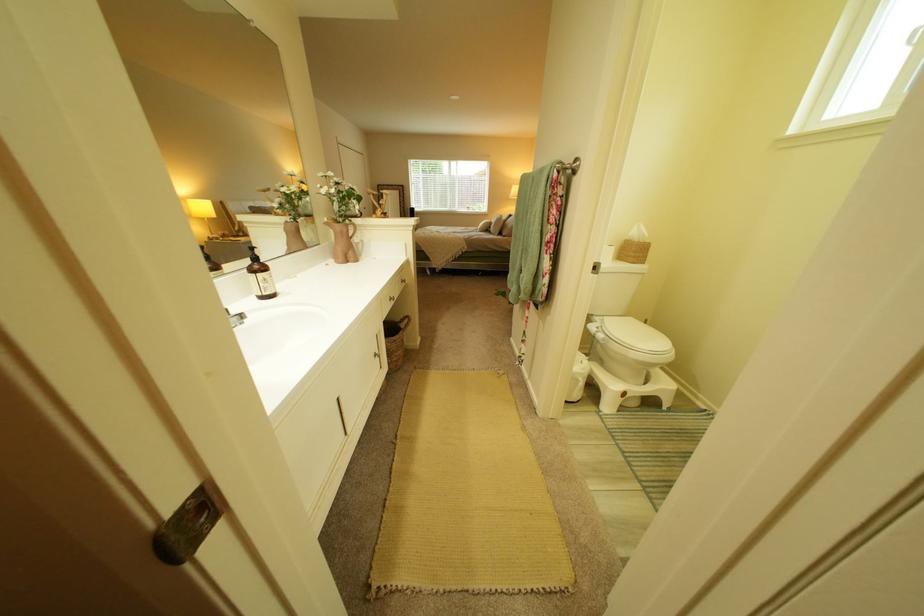
Find where to grasp the pink pitcher handle. Please return your answer as a coordinate pair (x, y).

(343, 240)